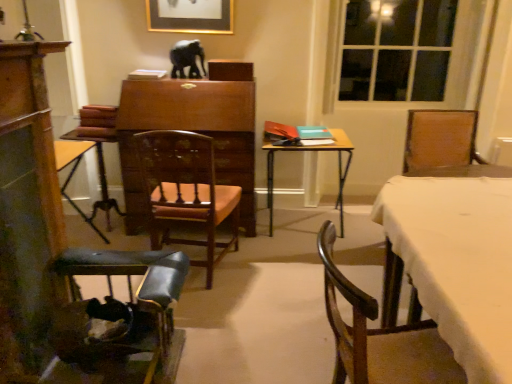
Find the location of `free space underneath wooden table at center (from a real-world perspective)`. free space underneath wooden table at center (from a real-world perspective) is located at coordinates (291, 233).